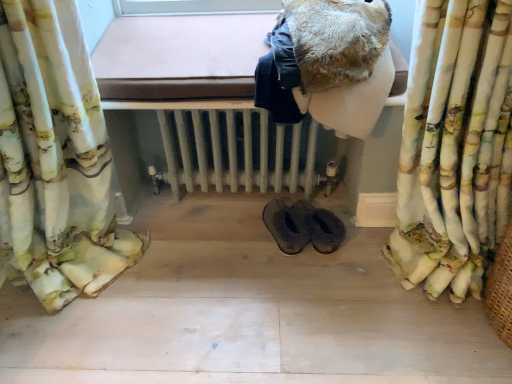
You are a GUI agent. You are given a task and a screenshot of the screen. Output one action in this format:
    pyautogui.click(x=<x>, y=<y>)
    Task: Click on the free space in front of black leather slippers at center
    The width and height of the screenshot is (512, 384).
    Given the screenshot: What is the action you would take?
    (x=312, y=298)